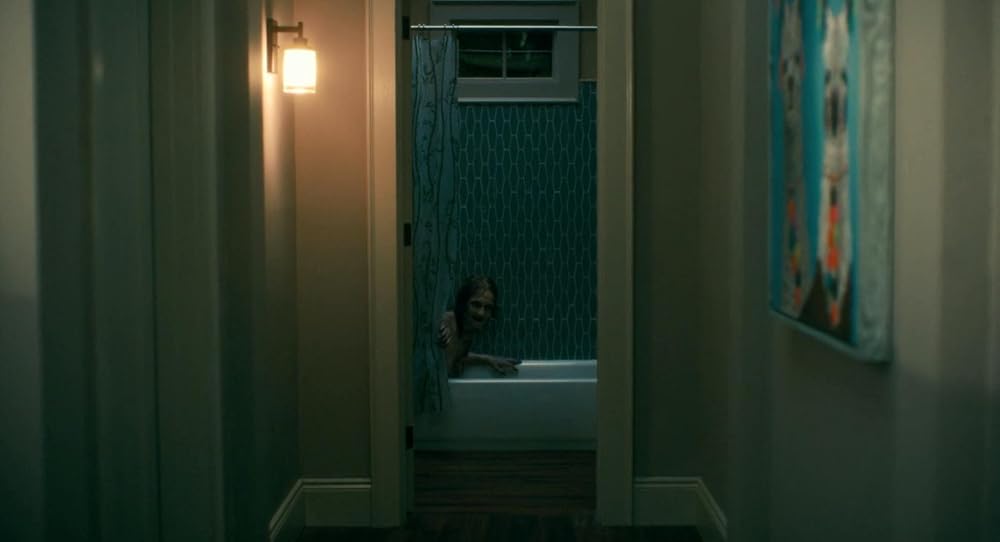
You are a GUI agent. You are given a task and a screenshot of the screen. Output one action in this format:
    pyautogui.click(x=<x>, y=<y>)
    Task: Click on the white bathtub
    
    Given the screenshot: What is the action you would take?
    pyautogui.click(x=551, y=400)